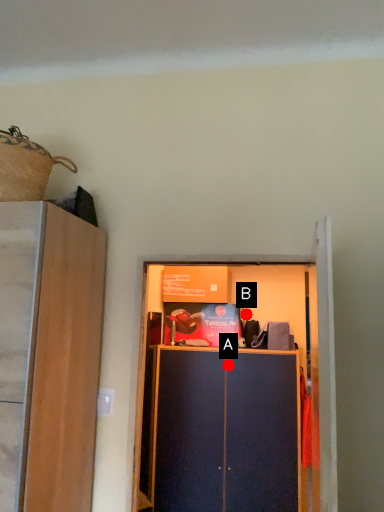
Question: Two points are circled on the image, labeled by A and B beside each circle. Which of the following is the closest to the observer?

Choices:
 (A) A is closer
 (B) B is closer

Answer: (A)